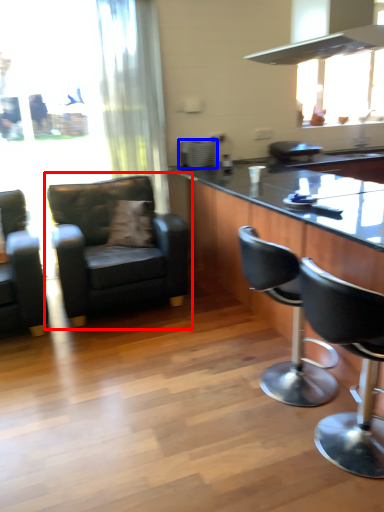
Question: Which object is further to the camera taking this photo, chair (highlighted by a red box) or appliance (highlighted by a blue box)?

Choices:
 (A) chair
 (B) appliance

Answer: (B)